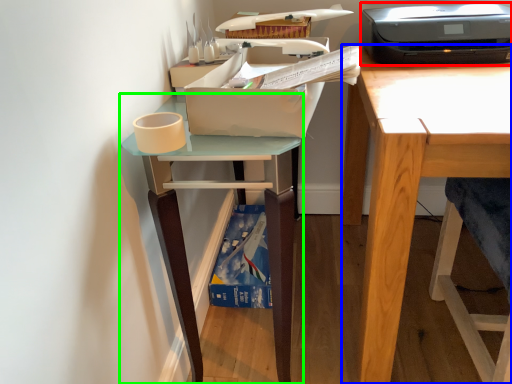
Question: Estimate the real-world distances between objects in this image. Which object is farther from printer (highlighted by a red box), desk (highlighted by a blue box) or table (highlighted by a green box)?

Choices:
 (A) desk
 (B) table

Answer: (B)